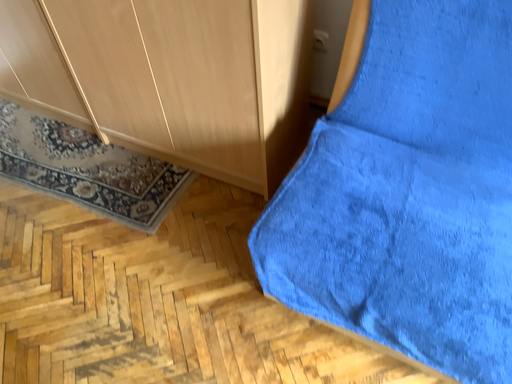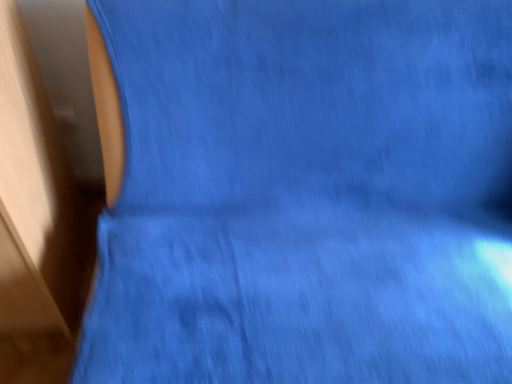
Question: Which way did the camera rotate in the video?

Choices:
 (A) rotated upward
 (B) rotated downward

Answer: (A)